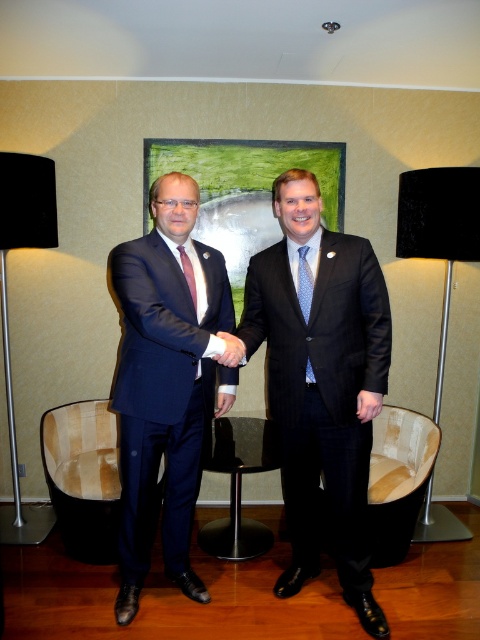
You are an artist observing two men shaking hands in a professional setting. You notice the blue dotted tie at center and the matte black hand at center. Which object is closer to you?

The blue dotted tie at center is closer to you than the matte black hand at center.

Based on the photo, you are an event planner arranging a photo shoot in the described scene. You need to place a small podium between the two people so that it doesn not block the view of the matte red tie at center. Where should you position the podium relative to the matte black suit at center?

The podium should be placed below the matte black suit at center since it is already positioned under the matte red tie at center, ensuring the red tie remains visible.

From the picture: You are an interior designer assessing the space between the black fabric lamp at left and the blue dotted tie at center. If you want to place a decorative item that is 1.2 meters wide between them, will there be enough space?

The black fabric lamp at left is wider than the blue dotted tie at center, but the exact distance between them isn